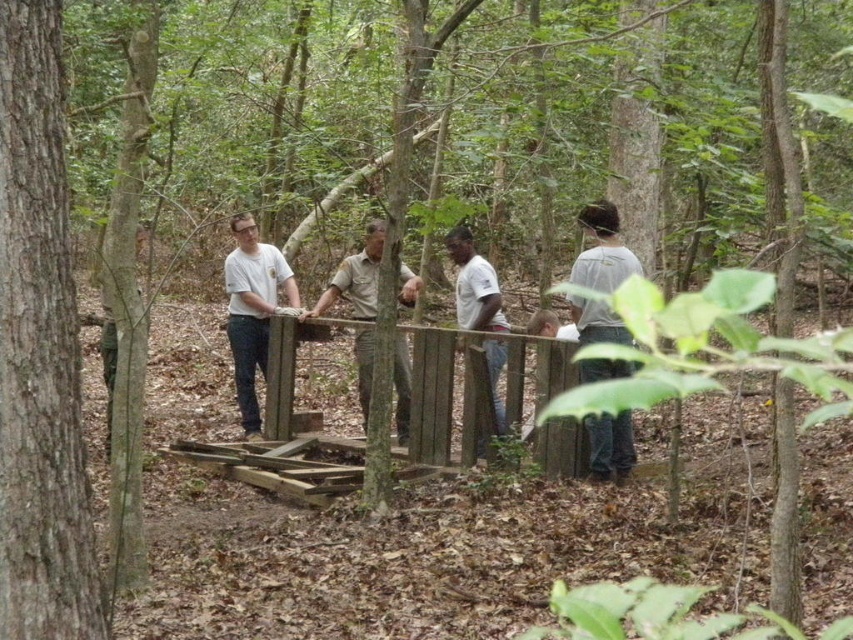
You are an observer in the forest scene. You notice the smooth brown tree trunk at left and the gray cotton shirt at center. Which object is narrower?

The smooth brown tree trunk at left is narrower than the gray cotton shirt at center.

You are standing at the center of the forest clearing and see a point marked at coordinates [39,349]. What object is located at this point?

The point at [39,349] marks the location of a smooth brown tree trunk at left.

Looking at this image, you are a photographer trying to capture a group photo of the brown uniform at center and the white matte shirt at center. Since you want them to stand side by side, which one should be on the left to maintain their current relative positions?

The brown uniform at center should be on the left because it is already positioned on the left side of the white matte shirt at center.